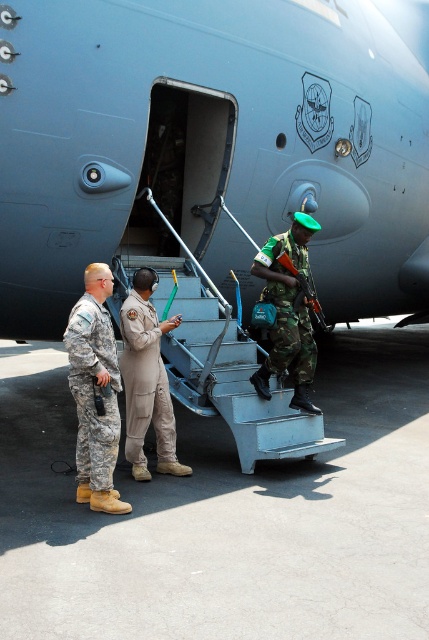
You are a photographer positioned at the airfield. You need to capture a photo that includes both the matte gray airplane at center and the camouflage fabric uniform at left. Based on their positions, which object should appear higher in the photo?

The matte gray airplane at center is located above the camouflage fabric uniform at left, so it will appear higher in the photo.

From the picture: You are a military officer at the airfield and need to move from point A to point B. Point A is at coordinate point (114, 228) and point B is at coordinate point (81, 433). Based on the scene, which direction should you move to go from point A to point B?

To move from point A at (114, 228) to point B at (81, 433), you should move forward since point A is behind point B according to the scene description.